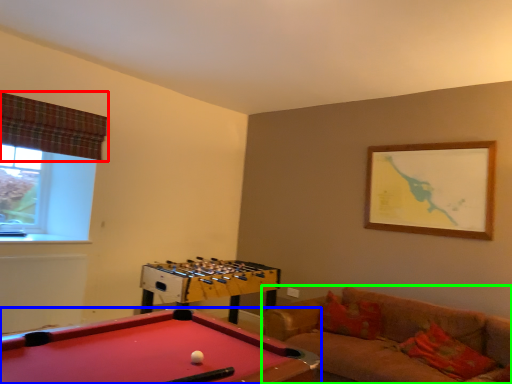
Question: Considering the real-world distances, which object is closest to curtain (highlighted by a red box)? billiard table (highlighted by a blue box) or studio couch (highlighted by a green box).

Choices:
 (A) billiard table
 (B) studio couch

Answer: (A)